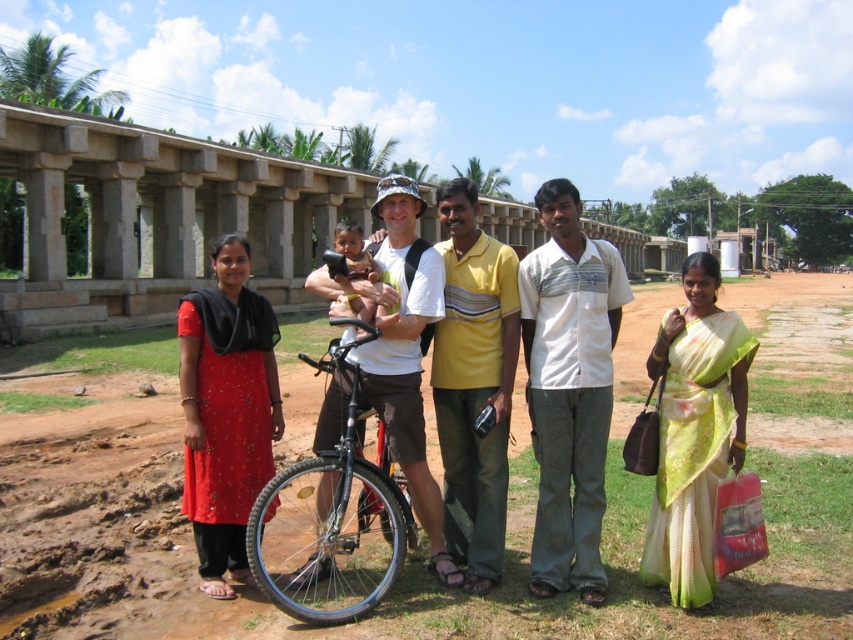
You are a photographer trying to capture a photo of the white striped shirt at center without the black matte bicycle at center blocking the view. Is the bicycle currently in front of or behind the shirt?

The black matte bicycle at center is behind the white striped shirt at center, so it is not blocking the view. You can take the photo without any obstruction.

You are a photographer trying to capture a clear photo of the soft yellow skin at center without the matte white bicycle at center blocking it. What should you do?

The matte white bicycle at center is in front of the soft yellow skin at center, so you should move the bicycle or adjust your position to ensure the soft yellow skin at center is visible behind it.